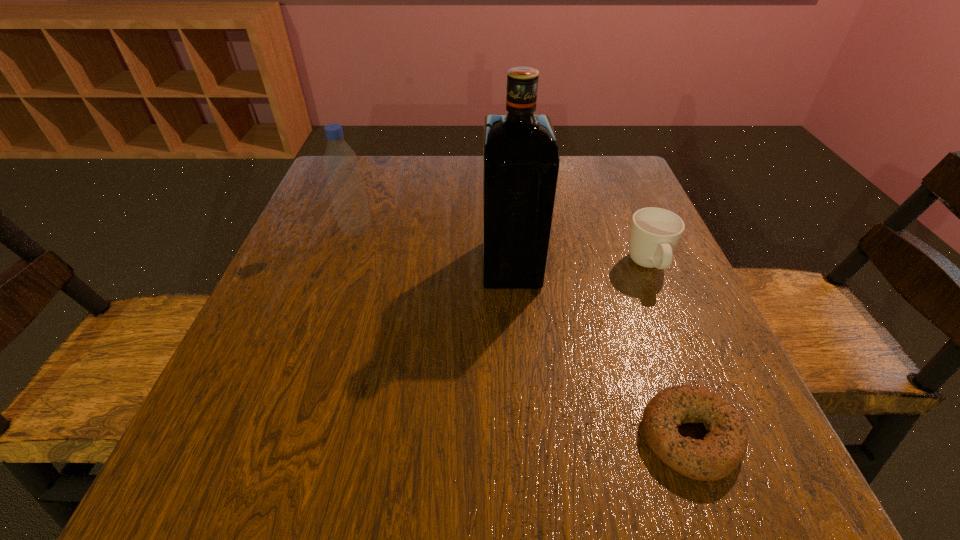
Image resolution: width=960 pixels, height=540 pixels. Find the location of `blank area located 0.230m on the front of the bottle`. blank area located 0.230m on the front of the bottle is located at coordinates (324, 320).

You are a GUI agent. You are given a task and a screenshot of the screen. Output one action in this format:
    pyautogui.click(x=<x>, y=<y>)
    Task: Click on the vacant region located 0.200m with the handle on the side of the second shortest object
    This screenshot has height=540, width=960.
    Given the screenshot: What is the action you would take?
    pyautogui.click(x=696, y=381)

Locate an element on the screen. This screenshot has height=540, width=960. vacant space situated 0.160m on the back of the bagel is located at coordinates (645, 315).

Identify the location of object located at the near edge. (721, 451).

Locate an element on the screen. This screenshot has width=960, height=540. object at the left edge is located at coordinates (341, 165).

Locate an element on the screen. The image size is (960, 540). cup situated at the right edge is located at coordinates (654, 233).

The image size is (960, 540). Find the location of `bagel located at the right edge`. bagel located at the right edge is located at coordinates (721, 451).

At what (x,y) coordinates should I click in order to perform the action: click on object that is at the near right corner. Please return your answer as a coordinate pair (x, y). This screenshot has width=960, height=540. Looking at the image, I should click on (721, 451).

At what (x,y) coordinates should I click in order to perform the action: click on free region at the far edge of the desktop. Please return your answer as a coordinate pair (x, y). The width and height of the screenshot is (960, 540). Looking at the image, I should click on pyautogui.click(x=450, y=185).

Identify the location of vacant space at the near edge. The image size is (960, 540). (468, 495).